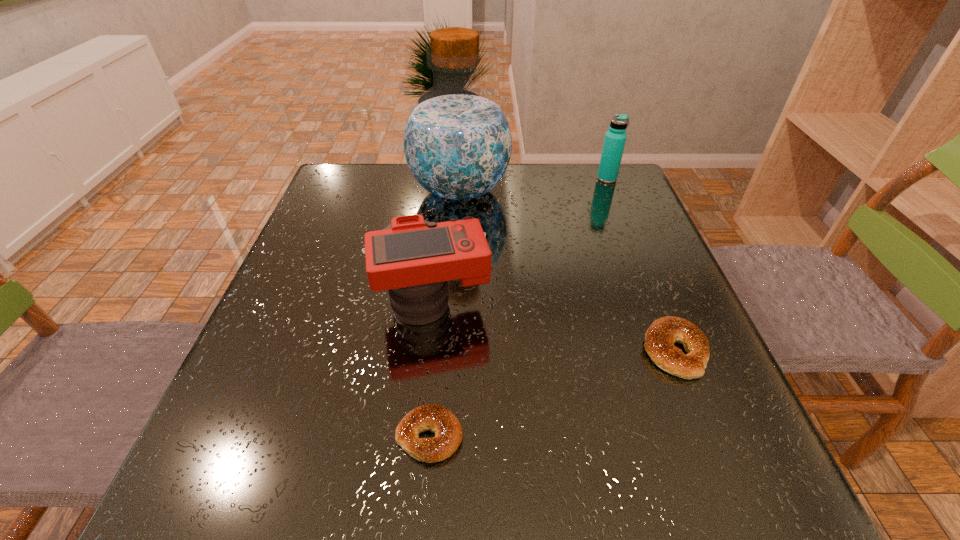
Locate an element on the screen. water jug is located at coordinates (457, 141).

This screenshot has height=540, width=960. Find the location of `water bottle`. water bottle is located at coordinates (615, 138).

This screenshot has height=540, width=960. In order to click on camera in this screenshot , I will do `click(414, 259)`.

Identify the location of the right bagel. The image size is (960, 540). (660, 337).

This screenshot has height=540, width=960. What are the coordinates of `the farther bagel` in the screenshot? It's located at (660, 337).

Find the location of a particular element. This screenshot has height=540, width=960. the left bagel is located at coordinates (448, 432).

Where is `the nearer bagel`? The height and width of the screenshot is (540, 960). the nearer bagel is located at coordinates (448, 432).

Find the location of `free space located 0.170m on the left of the water jug`. free space located 0.170m on the left of the water jug is located at coordinates (x=346, y=191).

Image resolution: width=960 pixels, height=540 pixels. What are the coordinates of `vacant area located 0.240m on the front of the water bottle` in the screenshot? It's located at (630, 236).

Identify the location of vacant position located on the right of the camera. Image resolution: width=960 pixels, height=540 pixels. (650, 303).